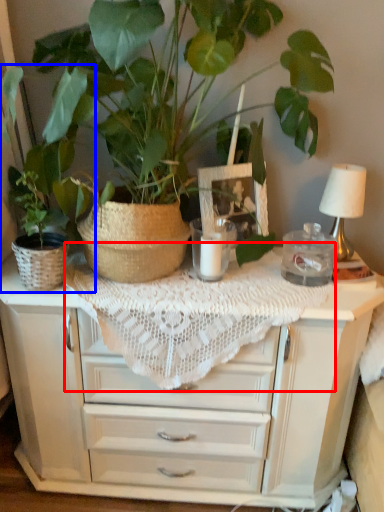
Question: Which of the following is the farthest to the observer, tablecloth (highlighted by a red box) or houseplant (highlighted by a blue box)?

Choices:
 (A) tablecloth
 (B) houseplant

Answer: (B)